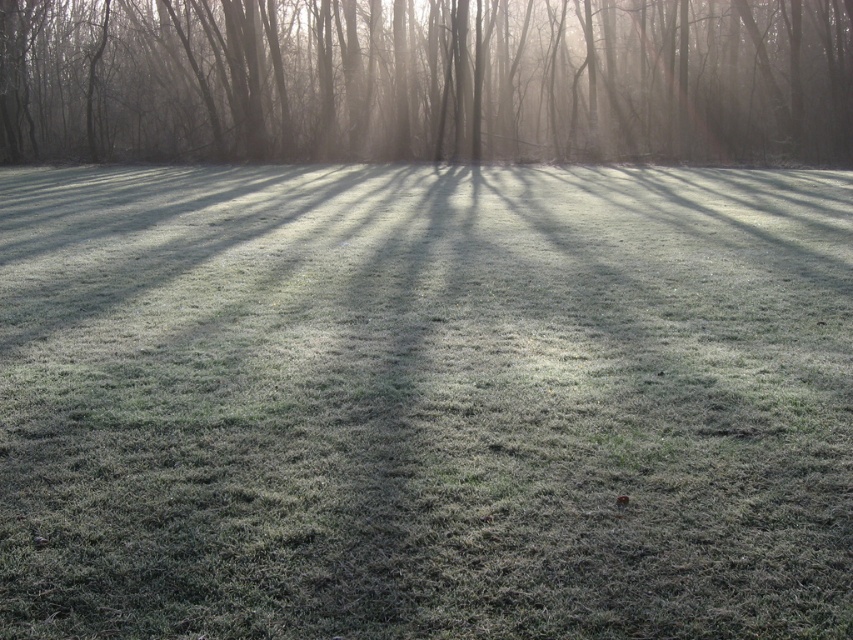
Is frosted grass at center wider than smooth bark tree at upper center?

Incorrect, frosted grass at center's width does not surpass smooth bark tree at upper center's.

Identify the location of frosted grass at center. (424, 403).